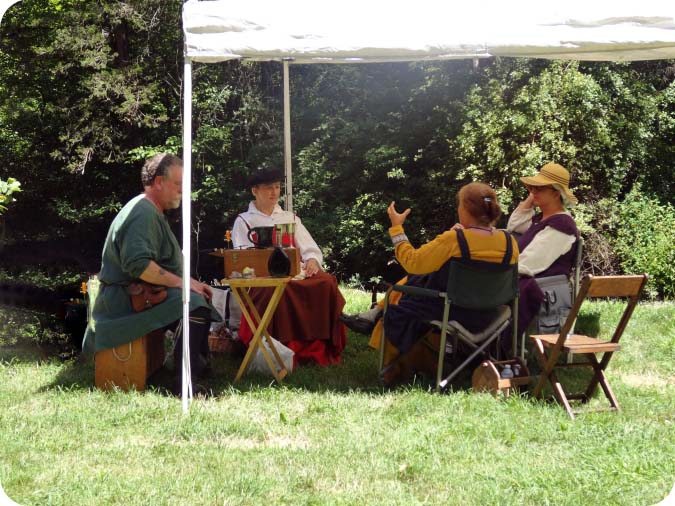
In order to click on cups in this screenshot , I will do `click(265, 235)`.